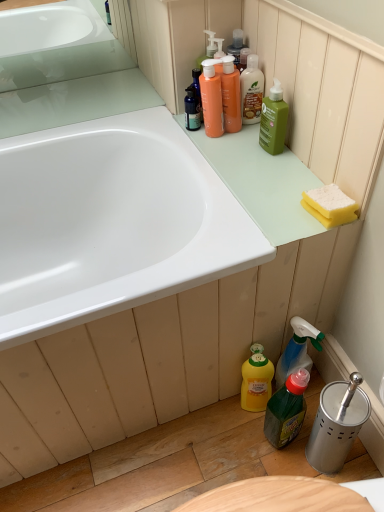
Locate an element on the screen. The image size is (384, 512). vacant area that lies between yellow sponge at upper right and translucent plastic mouthwash at upper center is located at coordinates (278, 162).